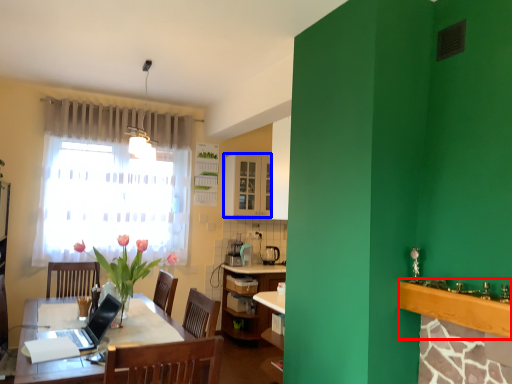
Question: Which object appears farthest to the camera in this image, counter top (highlighted by a red box) or cabinetry (highlighted by a blue box)?

Choices:
 (A) counter top
 (B) cabinetry

Answer: (B)